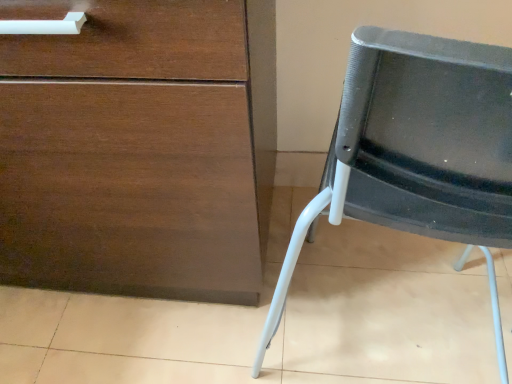
What do you see at coordinates (417, 152) in the screenshot?
I see `black mesh chair at right` at bounding box center [417, 152].

You are a GUI agent. You are given a task and a screenshot of the screen. Output one action in this format:
    pyautogui.click(x=<x>, y=<y>)
    Task: Click on the black mesh chair at right
    The width and height of the screenshot is (512, 384).
    Given the screenshot: What is the action you would take?
    pyautogui.click(x=417, y=152)

Locate an element on the screen. The image size is (512, 384). black mesh chair at right is located at coordinates (417, 152).